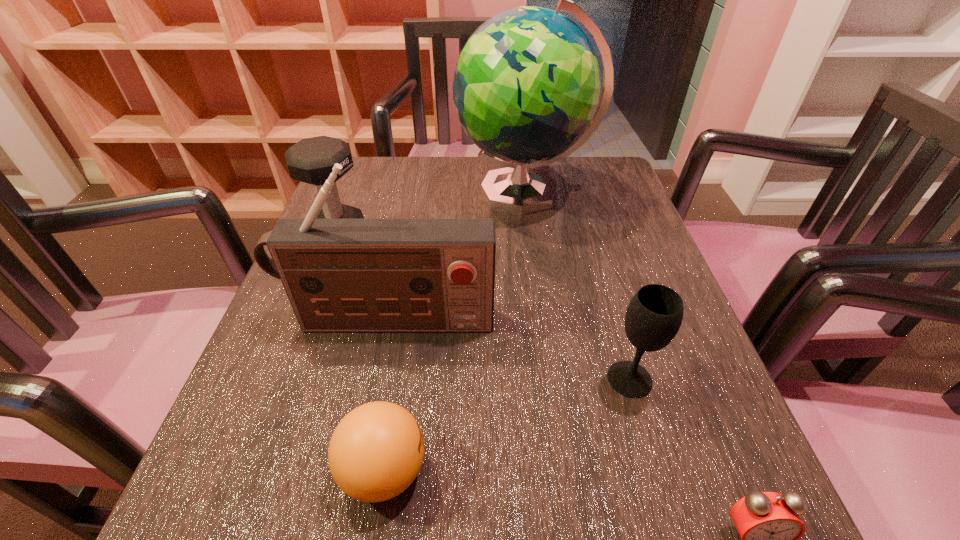
The width and height of the screenshot is (960, 540). I want to click on vacant space located 0.100m on the front panel of the third farthest object, so click(376, 388).

Locate an element on the screen. free space located 0.150m on the front of the dumbbell is located at coordinates (313, 306).

Where is `vacant space located on the front of the fourth farthest object`? The image size is (960, 540). vacant space located on the front of the fourth farthest object is located at coordinates (668, 510).

Locate an element on the screen. The width and height of the screenshot is (960, 540). vacant point located 0.160m on the side with brand of the second shortest object is located at coordinates (546, 471).

This screenshot has height=540, width=960. In order to click on object that is at the far edge in this screenshot , I will do `click(526, 86)`.

The image size is (960, 540). Find the location of `object located at the near edge`. object located at the near edge is located at coordinates (376, 451).

Where is `radio receiver that is positioned at the left edge`? radio receiver that is positioned at the left edge is located at coordinates (340, 275).

Locate an element on the screen. This screenshot has height=540, width=960. dumbbell that is at the left edge is located at coordinates (311, 160).

The height and width of the screenshot is (540, 960). Identify the location of globe at the right edge. (526, 86).

I want to click on wineglass that is at the right edge, so click(654, 315).